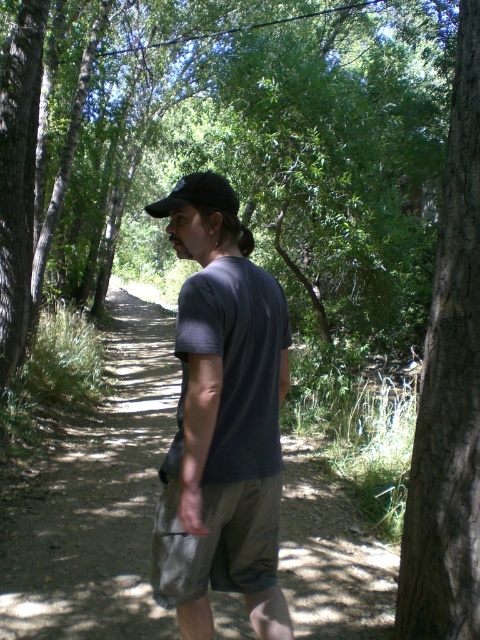
Which is below, brown rough bark tree at right or black matte baseball cap at center?

Positioned lower is brown rough bark tree at right.

Between brown rough bark tree at right and black matte baseball cap at center, which one appears on the right side from the viewer's perspective?

Positioned to the right is brown rough bark tree at right.

Locate an element on the screen. This screenshot has width=480, height=640. brown rough bark tree at right is located at coordinates pyautogui.click(x=448, y=390).

The width and height of the screenshot is (480, 640). Identify the location of brown rough bark tree at right. (448, 390).

Is dirt path at center below dark gray t-shirt at center?

Correct, dirt path at center is located below dark gray t-shirt at center.

Is dirt path at center taller than dark gray t-shirt at center?

No, dirt path at center is not taller than dark gray t-shirt at center.

Who is more forward, [71,552] or [253,506]?

Point [253,506]

You are a GUI agent. You are given a task and a screenshot of the screen. Output one action in this format:
    pyautogui.click(x=<x>, y=<y>)
    Task: Click on the dirt path at center
    The width and height of the screenshot is (480, 640).
    Given the screenshot: What is the action you would take?
    pyautogui.click(x=97, y=500)

Does dark gray t-shirt at center have a larger size compared to black matte baseball cap at center?

No.

Does dark gray t-shirt at center appear under black matte baseball cap at center?

Yes, dark gray t-shirt at center is below black matte baseball cap at center.

Find the location of a particular element. The width and height of the screenshot is (480, 640). dark gray t-shirt at center is located at coordinates (222, 420).

Where is `dark gray t-shirt at center`? dark gray t-shirt at center is located at coordinates (222, 420).